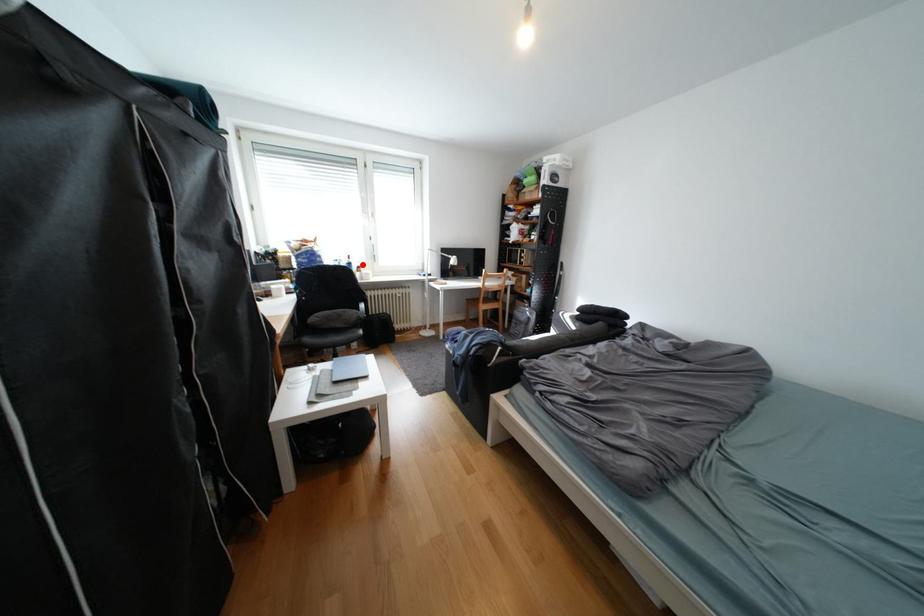
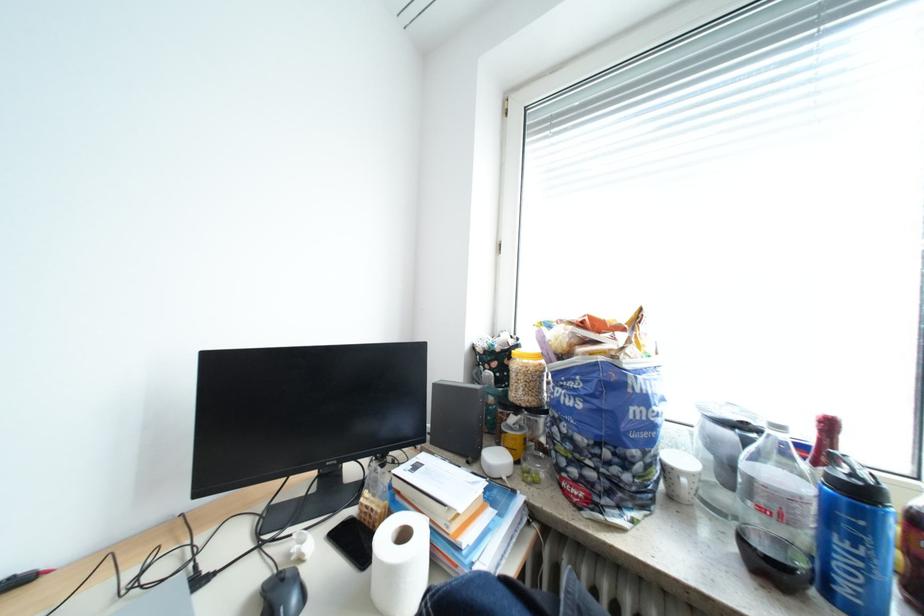
Question: I am providing you with two images of the same scene from different viewpoints. A red point is marked on the first image. At the location where the point appears in image 1, is it still visible in image 2?

Choices:
 (A) Yes
 (B) No

Answer: (A)